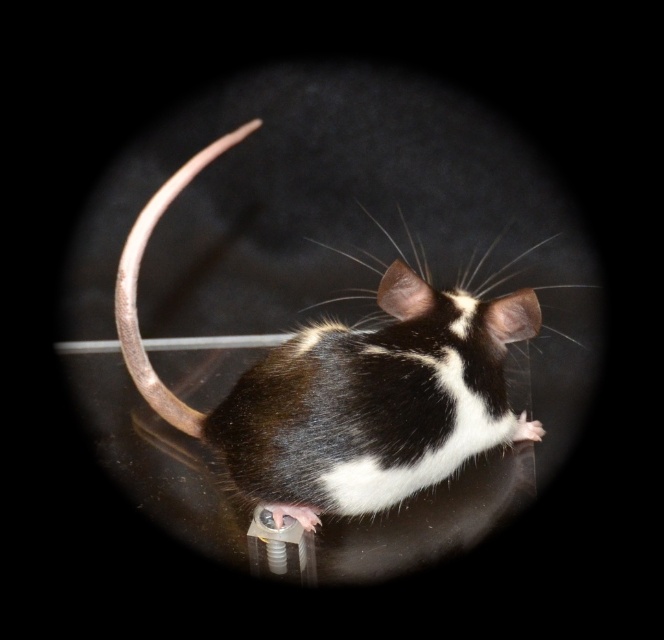
You are a wildlife photographer who wants to capture the mouse in the image. Since the black fur mouse at center and the metallic tail at center are both in focus, which one should you adjust your camera settings to prioritize in terms of size in the photo?

The black fur mouse at center is bigger than the metallic tail at center, so you should prioritize adjusting your camera settings to ensure the black fur mouse at center is the main focus due to its larger size.

You are a wildlife photographer who wants to capture the mouse in the image. Since the black fur mouse at center and metallic tail at center are both in focus, which one do you think is wider when viewed from your current position?

The black fur mouse at center is wider than the metallic tail at center, so the mouse will appear wider in the photo.

Where is the black fur mouse at center located in the image?

The black fur mouse at center is located at point coordinates of (347, 387).